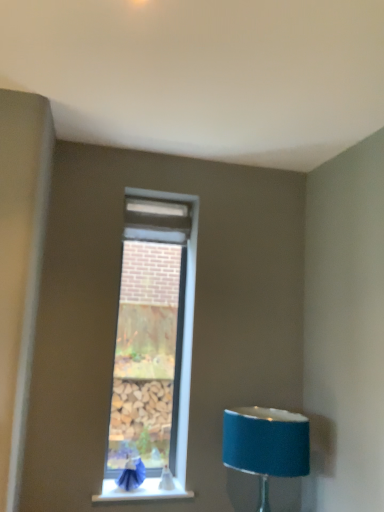
Question: Looking at their shapes, would you say white smooth window sill at lower center is wider or thinner than blue fabric swivel chair at lower left?

Choices:
 (A) wide
 (B) thin

Answer: (A)

Question: From the image's perspective, is white smooth window sill at lower center positioned above or below blue fabric swivel chair at lower left?

Choices:
 (A) below
 (B) above

Answer: (A)

Question: Considering the real-world distances, which object is farthest from the blue fabric lampshade at lower right?

Choices:
 (A) white smooth window sill at lower center
 (B) blue fabric swivel chair at lower left

Answer: (B)

Question: Considering the real-world distances, which object is closest to the blue fabric lampshade at lower right?

Choices:
 (A) blue fabric swivel chair at lower left
 (B) white smooth window sill at lower center

Answer: (B)